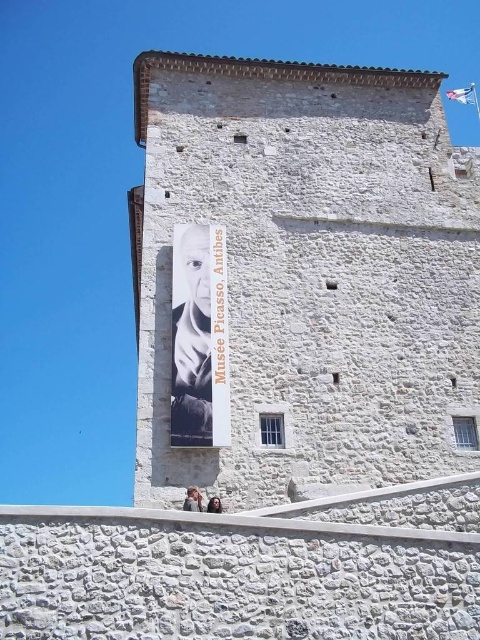
Question: Is white stone tower at center wider than white paper poster at center?

Choices:
 (A) yes
 (B) no

Answer: (A)

Question: Which of the following is the closest to the observer?

Choices:
 (A) white paper poster at center
 (B) white stone tower at center

Answer: (B)

Question: Is white stone tower at center further to the viewer compared to white paper poster at center?

Choices:
 (A) yes
 (B) no

Answer: (B)

Question: Does white stone tower at center have a lesser width compared to white paper poster at center?

Choices:
 (A) no
 (B) yes

Answer: (A)